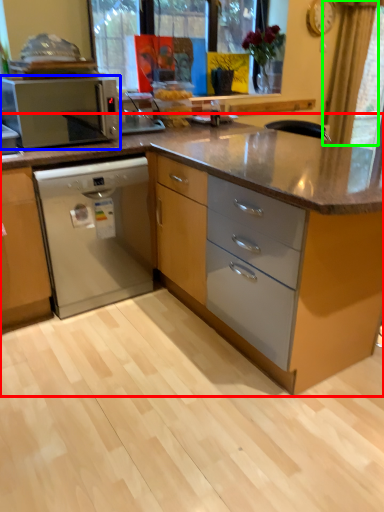
Question: Considering the real-world distances, which object is closest to cabinetry (highlighted by a red box)? kitchen appliance (highlighted by a blue box) or curtain (highlighted by a green box).

Choices:
 (A) kitchen appliance
 (B) curtain

Answer: (B)